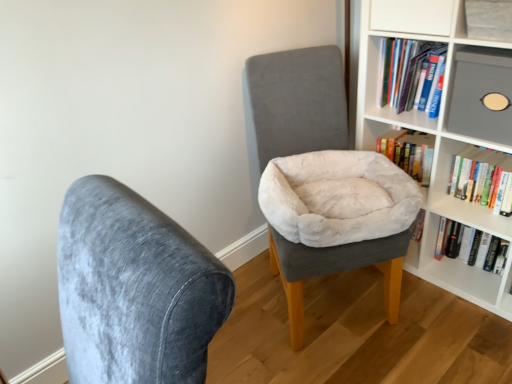
The height and width of the screenshot is (384, 512). Identify the location of vacant space positioned to the left of velvet gray chair at center, the 2th chair positioned from the left. (250, 316).